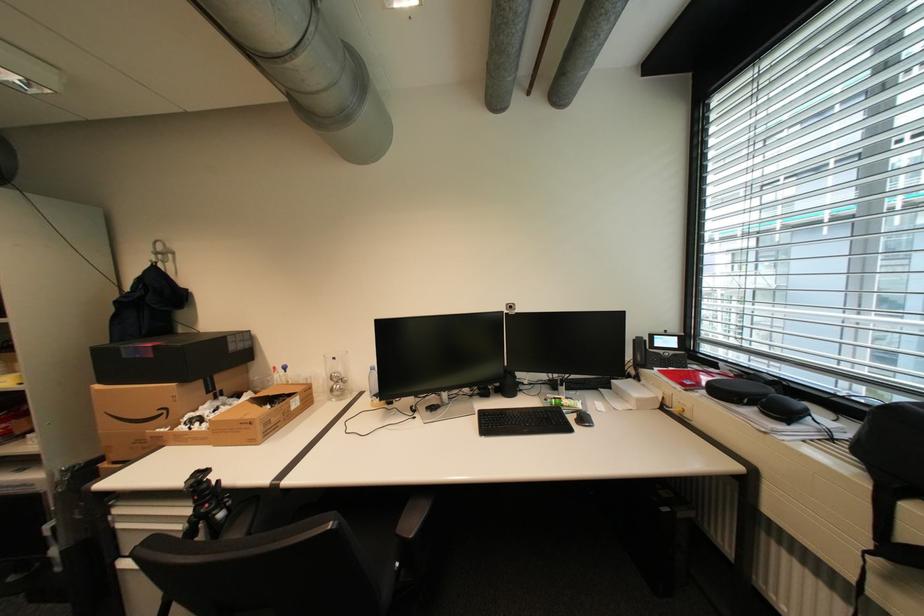
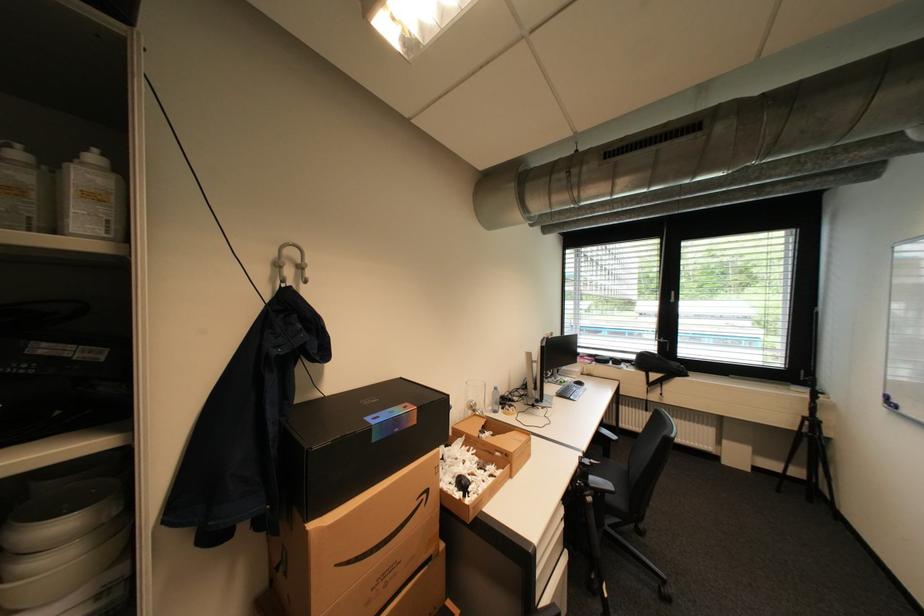
Where in the second image is the point corresponding to (x=344, y=374) from the first image?

(480, 402)